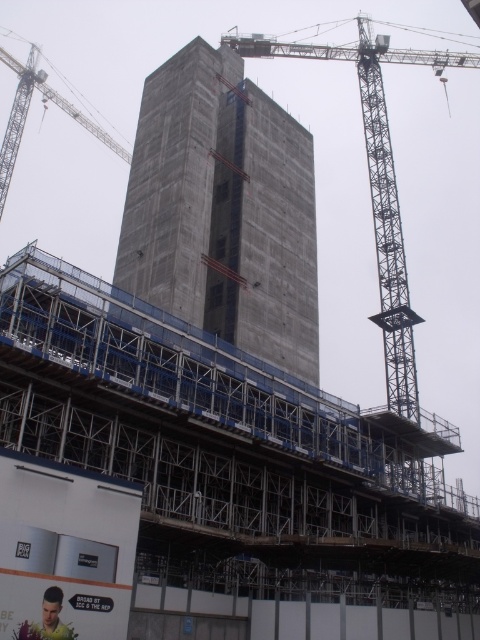
Question: Is concrete scaffolding at center thinner than gray metallic crane at center?

Choices:
 (A) yes
 (B) no

Answer: (A)

Question: Can you confirm if gray metallic crane at center is thinner than metallic gray crane at upper left?

Choices:
 (A) no
 (B) yes

Answer: (A)

Question: Which object is positioned farthest from the yellow shirt at lower left?

Choices:
 (A) concrete scaffolding at center
 (B) metallic gray crane at upper left

Answer: (B)

Question: Which of the following is the closest to the observer?

Choices:
 (A) concrete scaffolding at center
 (B) concrete at center

Answer: (A)

Question: Which is farther from the metallic gray crane at upper left?

Choices:
 (A) concrete scaffolding at center
 (B) concrete at center
 (C) yellow shirt at lower left
 (D) gray metallic crane at center

Answer: (C)

Question: Is gray metallic crane at center to the right of yellow shirt at lower left from the viewer's perspective?

Choices:
 (A) no
 (B) yes

Answer: (B)